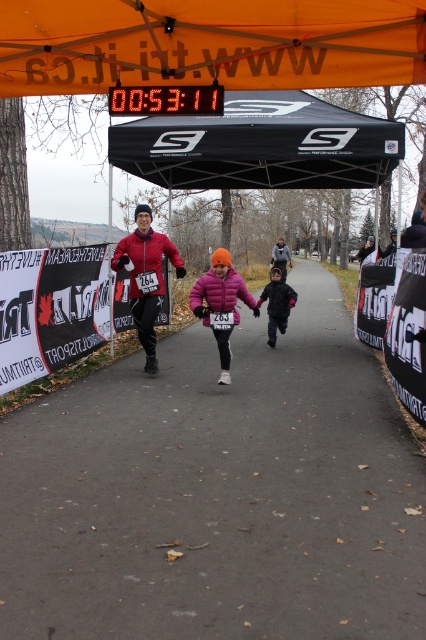
Can you confirm if pink fleece jacket at center is wider than black fuzzy hat at center?

Yes, pink fleece jacket at center is wider than black fuzzy hat at center.

Does pink fleece jacket at center appear on the left side of black fuzzy hat at center?

Yes, pink fleece jacket at center is to the left of black fuzzy hat at center.

Describe the element at coordinates (221, 305) in the screenshot. Image resolution: width=426 pixels, height=640 pixels. I see `pink fleece jacket at center` at that location.

Where is `pink fleece jacket at center`? pink fleece jacket at center is located at coordinates (221, 305).

How much distance is there between orange fabric canopy at upper center and pink fleece jacket at center?

orange fabric canopy at upper center is 8.98 feet from pink fleece jacket at center.

Identify the location of orange fabric canopy at upper center. The image size is (426, 640). (209, 44).

I want to click on orange fabric canopy at upper center, so click(x=209, y=44).

Which of these two, gray asphalt road at center or black fabric canopy at upper center, stands shorter?

Standing shorter between the two is black fabric canopy at upper center.

Is point (89, 580) less distant than point (252, 168)?

Yes, it is.

Is point (178, 364) behind point (261, 100)?

No.

Identify the location of gray asphalt road at center. (218, 492).